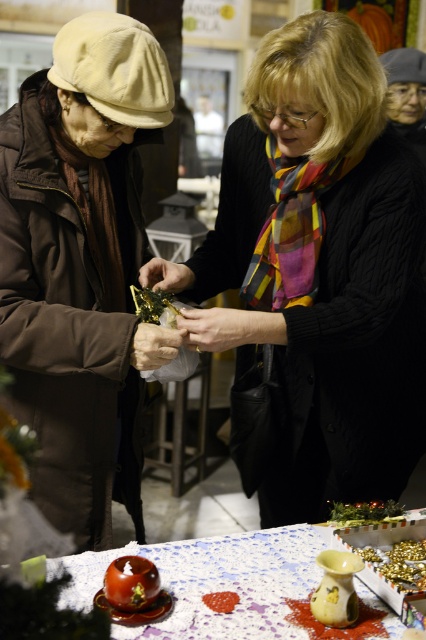
Question: Is the position of white textured tablecloth at lower center less distant than that of gold shiny foil at center?

Choices:
 (A) yes
 (B) no

Answer: (A)

Question: Observing the image, what is the correct spatial positioning of green leafy vegetable at center in reference to gold metallic ornament at center?

Choices:
 (A) left
 (B) right

Answer: (B)

Question: Which point is farther to the camera?

Choices:
 (A) (284, 540)
 (B) (140, 278)
 (C) (161, 362)

Answer: (B)

Question: Which of the following is the closest to the observer?

Choices:
 (A) (163, 356)
 (B) (152, 282)
 (C) (287, 580)

Answer: (C)

Question: Does matte black hand at center have a lesser width compared to shiny brown tomato at lower left?

Choices:
 (A) no
 (B) yes

Answer: (A)

Question: Which object is farther from the camera taking this photo?

Choices:
 (A) matte brown coat at left
 (B) matte gold ornament at center
 (C) green leafy vegetable at center
 (D) matte black hand at center

Answer: (D)